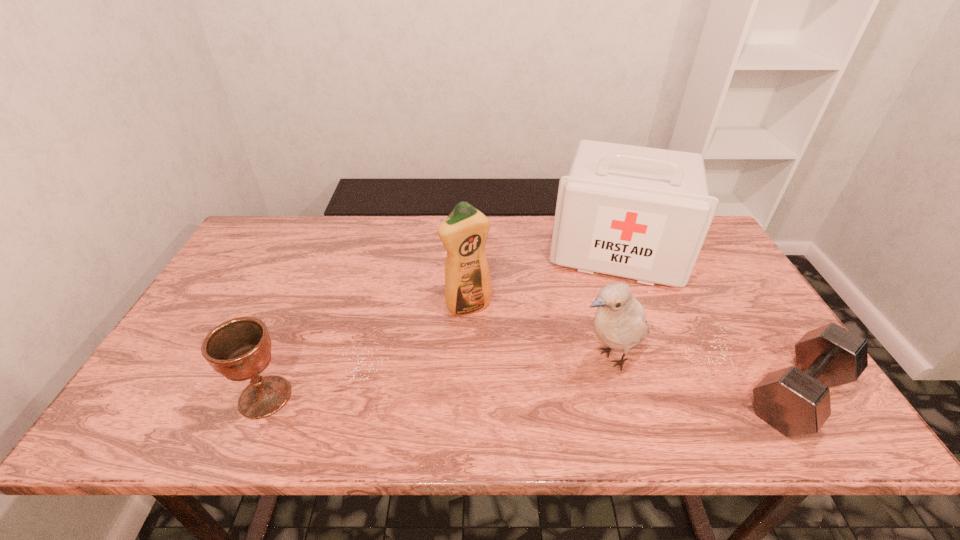
This screenshot has height=540, width=960. I want to click on the second shortest object, so point(240,349).

Where is `the leftmost object`? This screenshot has height=540, width=960. the leftmost object is located at coordinates (240, 349).

Find the location of a particular element. the shortest object is located at coordinates (795, 401).

You are a GUI agent. You are given a task and a screenshot of the screen. Output one action in this format:
    pyautogui.click(x=<x>, y=<y>)
    Task: Click on the third tallest object
    The height and width of the screenshot is (540, 960).
    Given the screenshot: What is the action you would take?
    pyautogui.click(x=620, y=323)

I want to click on the fourth nearest object, so click(x=468, y=289).

Where is `the fourth object from right to left`? the fourth object from right to left is located at coordinates (468, 289).

Image resolution: width=960 pixels, height=540 pixels. Find the location of `the first-aid kit`. the first-aid kit is located at coordinates (642, 213).

This screenshot has width=960, height=540. I want to click on vacant space located on the right of the leftmost object, so click(x=350, y=397).

Where is `free spot located on the left of the dumbbell`? This screenshot has width=960, height=540. free spot located on the left of the dumbbell is located at coordinates (714, 394).

I want to click on free location located at the beak of the bird, so click(x=541, y=388).